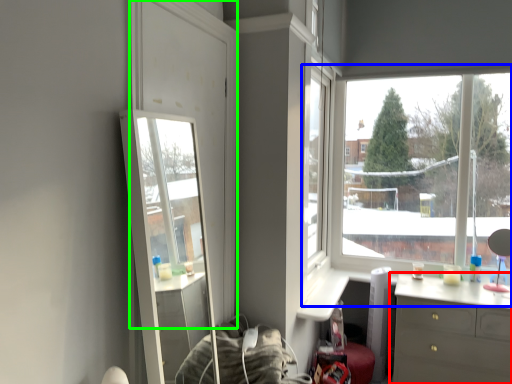
Question: Based on their relative distances, which object is nearer to chest of drawers (highlighted by a red box)? Choose from window (highlighted by a blue box) and glass door (highlighted by a green box).

Choices:
 (A) window
 (B) glass door

Answer: (A)